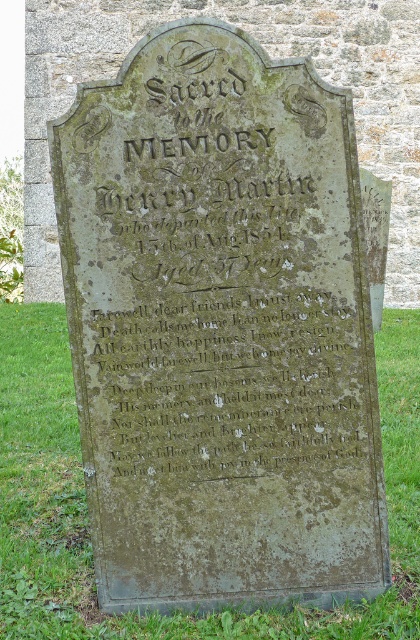
You are a groundskeeper tasked with mowing the lawn. You have a lawnmower that can cut grass up to 1.5 meters away from its position. You are currently standing at the green mossy stone inscription at center. Can you mow the green grass at lower center without moving the lawnmower?

The green grass at lower center is 1.36 meters away from the green mossy stone inscription at center. Since the lawnmower can cut grass up to 1.5 meters away, you can mow the green grass at lower center without moving the lawnmower.

You are standing in front of the gravestone and notice two points marked on it. Which point is closer to you, point at (89, 547) or point at (168, 154)?

Point at (168, 154) is closer to you because it is in front of point at (89, 547).

Based on the coordinates provided in the scene description, where exactly is the green grass at lower center located?

The green grass at lower center is located at the 2D coordinates point (86, 513).